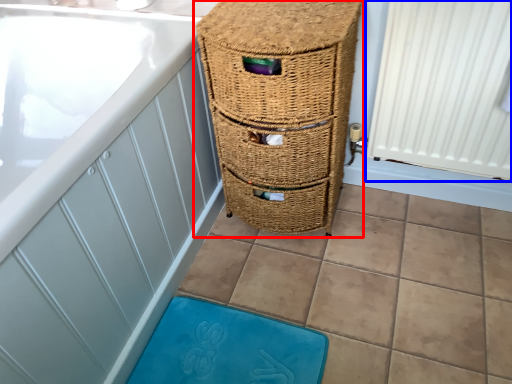
Question: Which of the following is the closest to the observer, furniture (highlighted by a red box) or radiator (highlighted by a blue box)?

Choices:
 (A) furniture
 (B) radiator

Answer: (B)